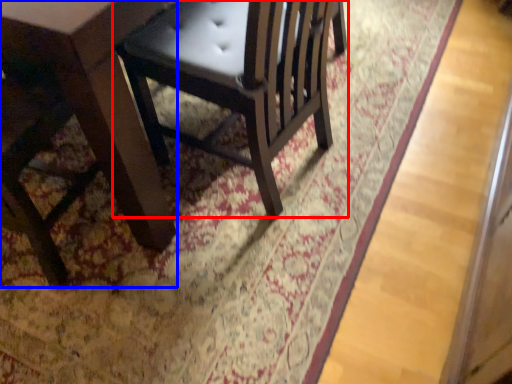
Question: Which object appears farthest to the camera in this image, chair (highlighted by a red box) or table (highlighted by a blue box)?

Choices:
 (A) chair
 (B) table

Answer: (A)